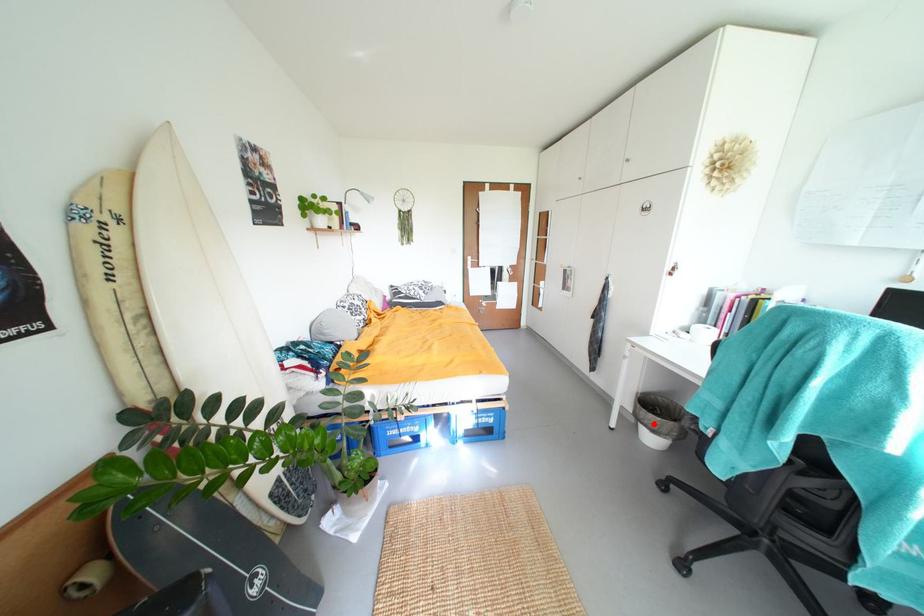
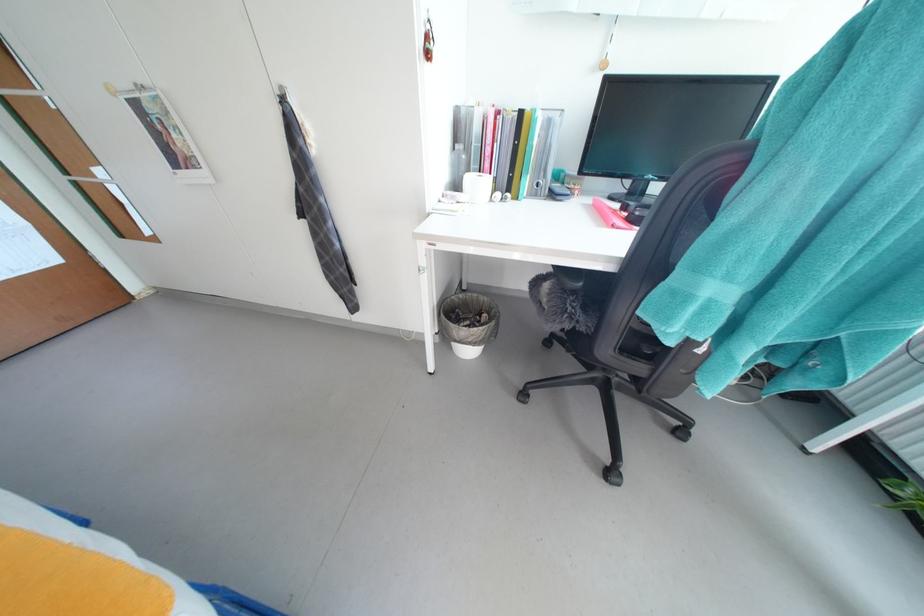
Question: I am providing you with two images of the same scene from different viewpoints. Image1 has a red point marked. In image2, the corresponding 3D location appears at what relative position? Reply with the corresponding letter.

Choices:
 (A) Closer
 (B) Farther

Answer: (B)